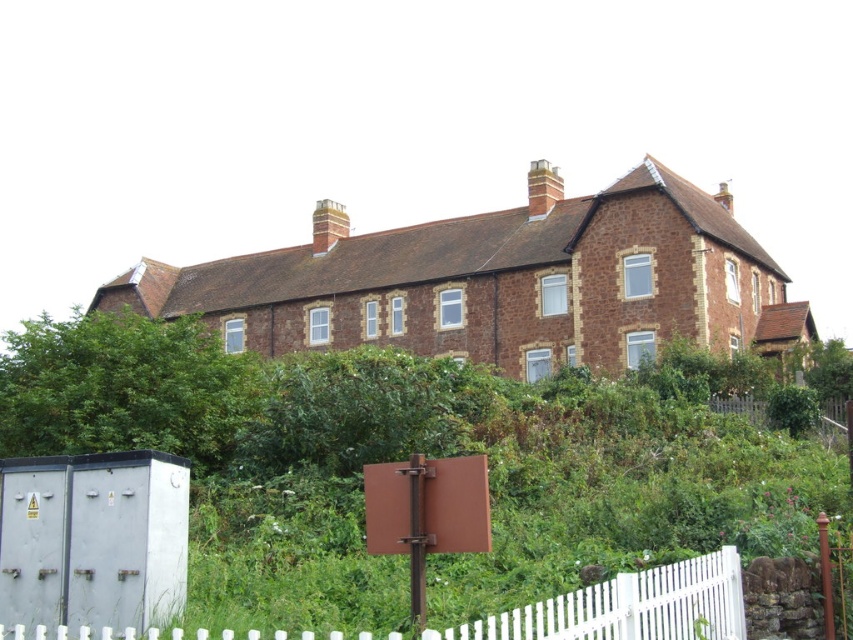
Consider the image. Is green leafy vegetation at center to the right of white picket fence at lower right from the viewer's perspective?

Incorrect, green leafy vegetation at center is not on the right side of white picket fence at lower right.

Which is in front, point (395, 396) or point (612, 579)?

Point (612, 579)

Where is `green leafy vegetation at center`? Image resolution: width=853 pixels, height=640 pixels. green leafy vegetation at center is located at coordinates (405, 458).